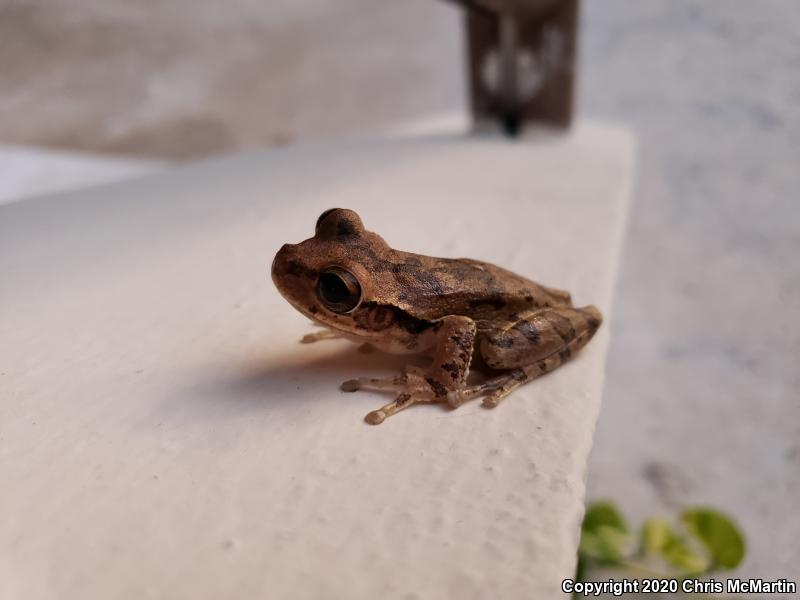
Find the location of `the left front leg`. the left front leg is located at coordinates (449, 366).